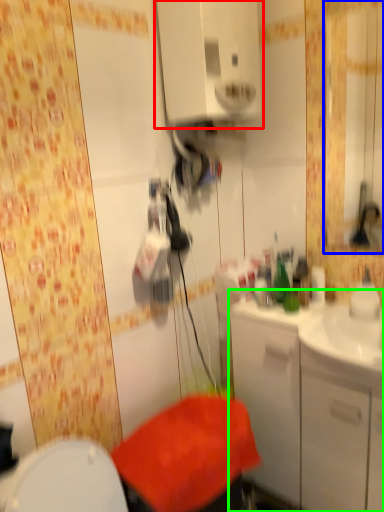
Question: Based on their relative distances, which object is nearer to medicine cabinet (highlighted by a red box)? Choose from mirror (highlighted by a blue box) and bathroom cabinet (highlighted by a green box).

Choices:
 (A) mirror
 (B) bathroom cabinet

Answer: (B)